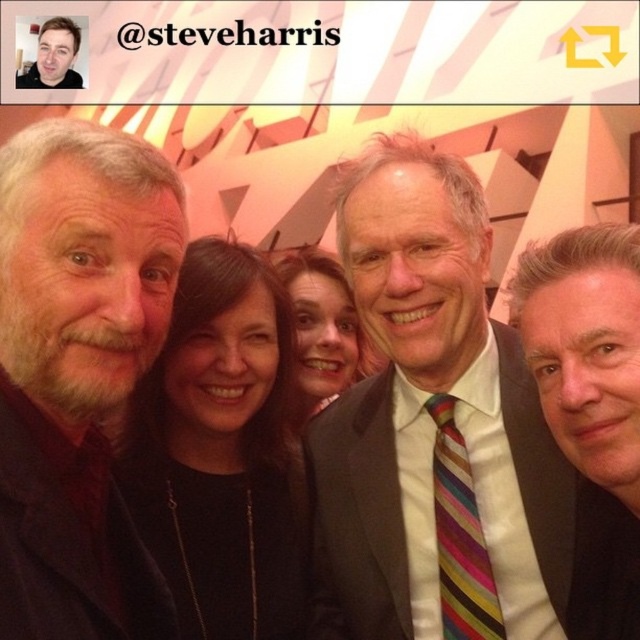
Question: Which object is farther from the camera taking this photo?

Choices:
 (A) striped tie at center
 (B) black fabric at center
 (C) smooth black suit at center
 (D) striped silk tie at center

Answer: (B)

Question: Can you confirm if gray beard at left is positioned below matte black jacket at upper left?

Choices:
 (A) yes
 (B) no

Answer: (A)

Question: Does gray beard at left appear over matte black hair at center?

Choices:
 (A) yes
 (B) no

Answer: (B)

Question: Which is farther from the striped tie at center?

Choices:
 (A) smooth black suit at center
 (B) matte black jacket at upper left
 (C) black fabric at center

Answer: (B)

Question: Which of the following is the closest to the observer?

Choices:
 (A) smooth black suit at center
 (B) gray beard at left

Answer: (B)

Question: Does smooth black suit at center come behind matte black jacket at upper left?

Choices:
 (A) yes
 (B) no

Answer: (B)